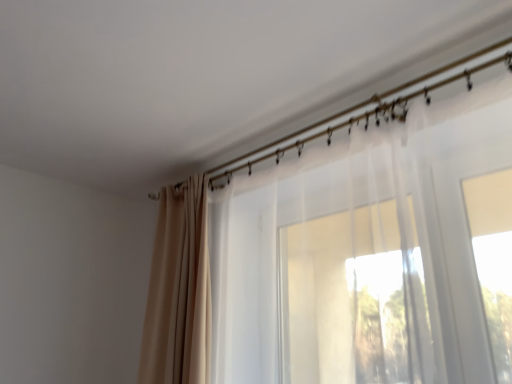
The height and width of the screenshot is (384, 512). I want to click on metallic gold curtain rod at upper center, so click(368, 110).

What is the approximate height of metallic gold curtain rod at upper center?

metallic gold curtain rod at upper center is 1.68 inches tall.

Consider the image. How much space does beige fabric curtain at upper left, the 2th curtain in the right-to-left sequence, occupy vertically?

It is 34.00 inches.

Locate an element on the screen. This screenshot has height=384, width=512. metallic gold curtain rod at upper center is located at coordinates (368, 110).

Looking at their sizes, would you say metallic gold curtain rod at upper center is wider or thinner than beige fabric curtain at upper left, the 2th curtain in the right-to-left sequence?

metallic gold curtain rod at upper center is thinner than beige fabric curtain at upper left, the 2th curtain in the right-to-left sequence.

Is metallic gold curtain rod at upper center bigger or smaller than beige fabric curtain at upper left, the 2th curtain in the right-to-left sequence?

In the image, metallic gold curtain rod at upper center appears to be smaller than beige fabric curtain at upper left, the 2th curtain in the right-to-left sequence.

From a real-world perspective, count 2nd curtains downward from the metallic gold curtain rod at upper center and point to it. Please provide its 2D coordinates.

[(179, 290)]

Is translucent white curtain at center, acting as the second curtain starting from the left, beside beige fabric curtain at upper left, the 2th curtain in the right-to-left sequence?

There is a gap between translucent white curtain at center, acting as the second curtain starting from the left, and beige fabric curtain at upper left, the 2th curtain in the right-to-left sequence.

From a real-world perspective, who is located higher, translucent white curtain at center, the first curtain from the right, or beige fabric curtain at upper left, which is counted as the 1th curtain, starting from the left?

translucent white curtain at center, the first curtain from the right.

Is point (259, 382) closer or farther from the camera than point (182, 238)?

Point (259, 382).

Which of these two, translucent white curtain at center, acting as the second curtain starting from the left, or beige fabric curtain at upper left, which is counted as the 1th curtain, starting from the left, is bigger?

Bigger between the two is translucent white curtain at center, acting as the second curtain starting from the left.

Is the position of translucent white curtain at center, acting as the second curtain starting from the left, less distant than that of metallic gold curtain rod at upper center?

Yes, it is in front of metallic gold curtain rod at upper center.

Would you say translucent white curtain at center, the first curtain from the right, is outside metallic gold curtain rod at upper center?

Yes, translucent white curtain at center, the first curtain from the right, is outside of metallic gold curtain rod at upper center.

From a real-world perspective, between translucent white curtain at center, the first curtain from the right, and metallic gold curtain rod at upper center, who is vertically lower?

translucent white curtain at center, the first curtain from the right, is physically lower.

Considering the sizes of objects translucent white curtain at center, acting as the second curtain starting from the left, and metallic gold curtain rod at upper center in the image provided, who is thinner, translucent white curtain at center, acting as the second curtain starting from the left, or metallic gold curtain rod at upper center?

Thinner between the two is metallic gold curtain rod at upper center.

In the image, there is a beige fabric curtain at upper left, the 2th curtain in the right-to-left sequence. At what (x,y) coordinates should I click in order to perform the action: click on curtain above it (from the image's perspective). Please return your answer as a coordinate pair (x, y). The image size is (512, 384). Looking at the image, I should click on (362, 254).

Visually, is beige fabric curtain at upper left, which is counted as the 1th curtain, starting from the left, positioned to the left or to the right of translucent white curtain at center, acting as the second curtain starting from the left?

Based on their positions, beige fabric curtain at upper left, which is counted as the 1th curtain, starting from the left, is located to the left of translucent white curtain at center, acting as the second curtain starting from the left.

Does beige fabric curtain at upper left, which is counted as the 1th curtain, starting from the left, have a smaller size compared to translucent white curtain at center, the first curtain from the right?

Yes.

Is beige fabric curtain at upper left, which is counted as the 1th curtain, starting from the left, looking in the opposite direction of translucent white curtain at center, acting as the second curtain starting from the left?

No, beige fabric curtain at upper left, which is counted as the 1th curtain, starting from the left, is not facing away from translucent white curtain at center, acting as the second curtain starting from the left.

The width and height of the screenshot is (512, 384). I want to click on the 1st curtain below the metallic gold curtain rod at upper center (from the image's perspective), so click(x=362, y=254).

Considering the points (382, 94) and (268, 216), which point is in front, point (382, 94) or point (268, 216)?

The point (382, 94) is closer.

From a real-world perspective, between metallic gold curtain rod at upper center and translucent white curtain at center, the first curtain from the right, who is vertically lower?

From a 3D spatial view, translucent white curtain at center, the first curtain from the right, is below.

Is beige fabric curtain at upper left, which is counted as the 1th curtain, starting from the left, positioned beyond the bounds of metallic gold curtain rod at upper center?

Yes, beige fabric curtain at upper left, which is counted as the 1th curtain, starting from the left, is outside of metallic gold curtain rod at upper center.

Considering the relative positions of beige fabric curtain at upper left, which is counted as the 1th curtain, starting from the left, and metallic gold curtain rod at upper center in the image provided, is beige fabric curtain at upper left, which is counted as the 1th curtain, starting from the left, to the left of metallic gold curtain rod at upper center from the viewer's perspective?

Yes, beige fabric curtain at upper left, which is counted as the 1th curtain, starting from the left, is to the left of metallic gold curtain rod at upper center.

Locate an element on the screen. Image resolution: width=512 pixels, height=384 pixels. curtain that is on the left side of metallic gold curtain rod at upper center is located at coordinates (179, 290).

Where is `curtain behind the metallic gold curtain rod at upper center`? This screenshot has height=384, width=512. curtain behind the metallic gold curtain rod at upper center is located at coordinates (179, 290).

Find the location of a particular element. curtain on the right side of beige fabric curtain at upper left, the 2th curtain in the right-to-left sequence is located at coordinates (362, 254).

Estimate the real-world distances between objects in this image. Which object is closer to metallic gold curtain rod at upper center, beige fabric curtain at upper left, which is counted as the 1th curtain, starting from the left, or translucent white curtain at center, acting as the second curtain starting from the left?

Among the two, translucent white curtain at center, acting as the second curtain starting from the left, is located nearer to metallic gold curtain rod at upper center.

Estimate the real-world distances between objects in this image. Which object is further from beige fabric curtain at upper left, the 2th curtain in the right-to-left sequence, translucent white curtain at center, the first curtain from the right, or metallic gold curtain rod at upper center?

metallic gold curtain rod at upper center is positioned further to the anchor beige fabric curtain at upper left, the 2th curtain in the right-to-left sequence.

Which object lies further to the anchor point metallic gold curtain rod at upper center, translucent white curtain at center, the first curtain from the right, or beige fabric curtain at upper left, which is counted as the 1th curtain, starting from the left?

Based on the image, beige fabric curtain at upper left, which is counted as the 1th curtain, starting from the left, appears to be further to metallic gold curtain rod at upper center.

Looking at the image, which one is located closer to beige fabric curtain at upper left, the 2th curtain in the right-to-left sequence, metallic gold curtain rod at upper center or translucent white curtain at center, acting as the second curtain starting from the left?

The object closer to beige fabric curtain at upper left, the 2th curtain in the right-to-left sequence, is translucent white curtain at center, acting as the second curtain starting from the left.

Estimate the real-world distances between objects in this image. Which object is further from translucent white curtain at center, acting as the second curtain starting from the left, metallic gold curtain rod at upper center or beige fabric curtain at upper left, the 2th curtain in the right-to-left sequence?

beige fabric curtain at upper left, the 2th curtain in the right-to-left sequence, lies further to translucent white curtain at center, acting as the second curtain starting from the left, than the other object.

Based on the photo, estimate the real-world distances between objects in this image. Which object is closer to translucent white curtain at center, acting as the second curtain starting from the left, beige fabric curtain at upper left, which is counted as the 1th curtain, starting from the left, or metallic gold curtain rod at upper center?

metallic gold curtain rod at upper center lies closer to translucent white curtain at center, acting as the second curtain starting from the left, than the other object.

Locate an element on the screen. The image size is (512, 384). curtain between metallic gold curtain rod at upper center and beige fabric curtain at upper left, the 2th curtain in the right-to-left sequence, in the vertical direction is located at coordinates (362, 254).